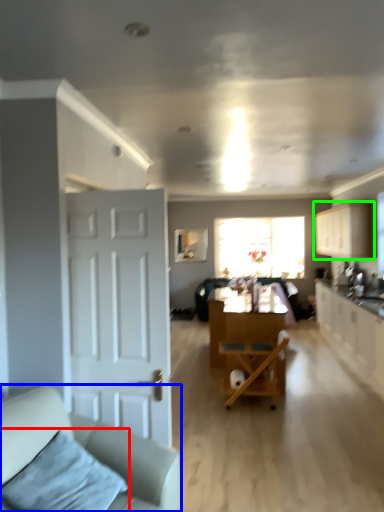
Question: Based on their relative distances, which object is nearer to pillow (highlighted by a red box)? Choose from studio couch (highlighted by a blue box) and cabinetry (highlighted by a green box).

Choices:
 (A) studio couch
 (B) cabinetry

Answer: (A)